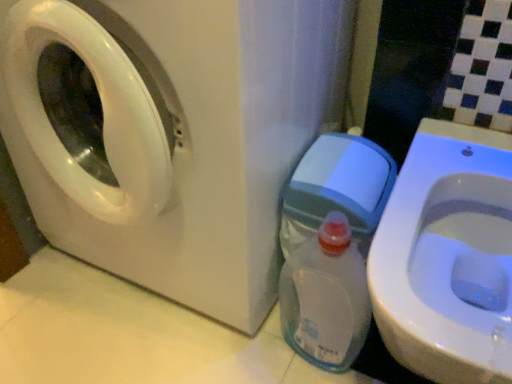
Find the location of a particular element. vacant space situated on the left part of clear plastic bottle at lower right is located at coordinates (226, 349).